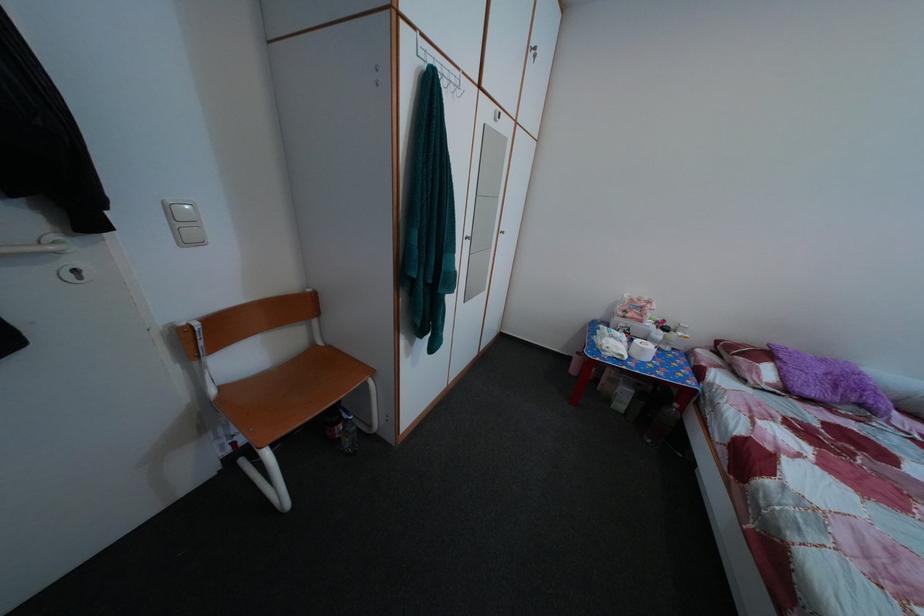
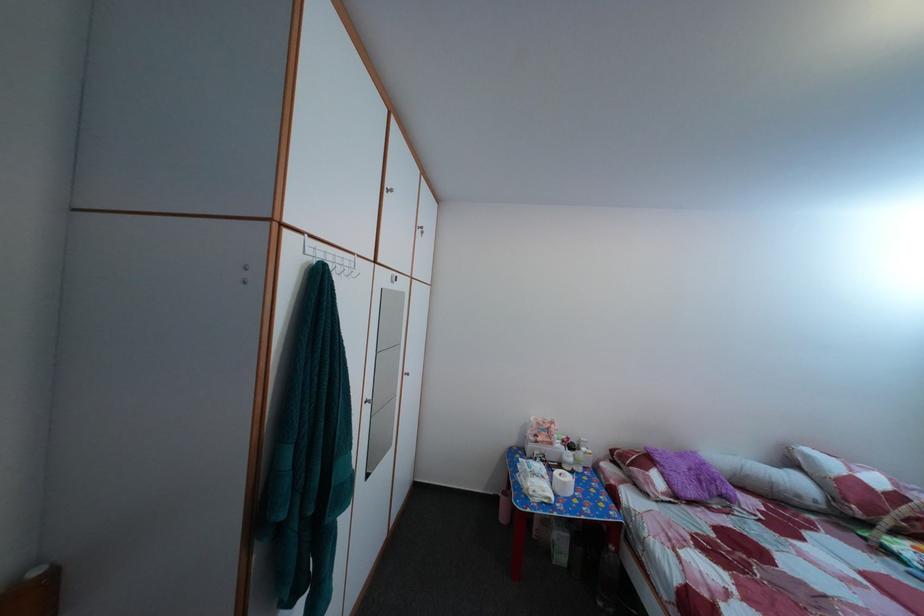
In the second image, find the point that corresponds to (463,86) in the first image.

(356, 270)